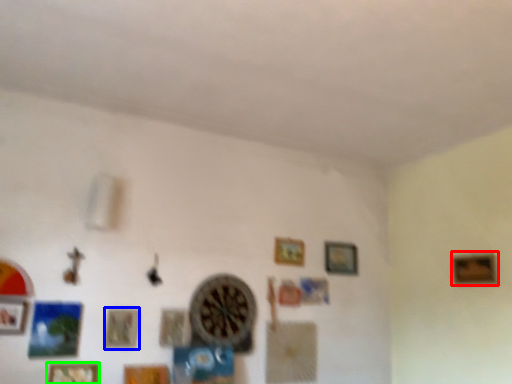
Question: Which object is the farthest from picture frame (highlighted by a red box)? Choose among these: picture frame (highlighted by a blue box) or picture frame (highlighted by a green box).

Choices:
 (A) picture frame
 (B) picture frame

Answer: (B)